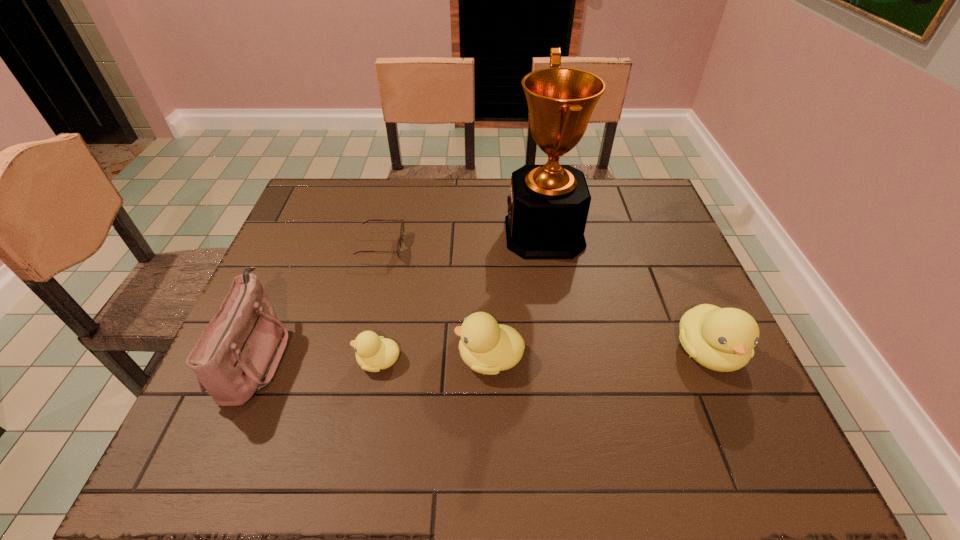
Identify the location of blank space located at the beak of the fifth tallest object. The width and height of the screenshot is (960, 540). (265, 361).

Identify the location of free region located 0.060m at the beak of the fourth tallest object. The width and height of the screenshot is (960, 540). (429, 357).

Identify the location of vacant area located 0.210m at the beak of the fourth tallest object. Image resolution: width=960 pixels, height=540 pixels. (361, 357).

Where is `vacant space located 0.060m at the beak of the fourth tallest object`? vacant space located 0.060m at the beak of the fourth tallest object is located at coordinates coord(429,357).

At what (x,y) coordinates should I click in order to perform the action: click on free space located 0.060m at the beak of the rightmost object. Please return your answer as a coordinate pair (x, y). The width and height of the screenshot is (960, 540). Looking at the image, I should click on (735, 412).

Where is `blank space located 0.140m on the front of the tallest object with the label`? The height and width of the screenshot is (540, 960). blank space located 0.140m on the front of the tallest object with the label is located at coordinates tap(458, 234).

This screenshot has width=960, height=540. In order to click on free location located 0.070m on the front of the tallest object with the label in this screenshot , I will do `click(482, 234)`.

Locate an element on the screen. The width and height of the screenshot is (960, 540). vacant space situated on the front of the tallest object with the label is located at coordinates (482, 234).

Identify the location of vacant space situated at the front view of the shortest object. The image size is (960, 540). (435, 247).

Where is `free region located on the front pocket of the shoulder bag`? This screenshot has height=540, width=960. free region located on the front pocket of the shoulder bag is located at coordinates (308, 357).